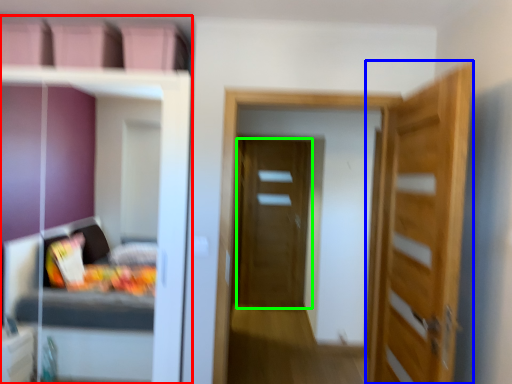
Question: Which is farther away from dresser (highlighted by a red box)? door (highlighted by a blue box) or door (highlighted by a green box)?

Choices:
 (A) door
 (B) door

Answer: (B)